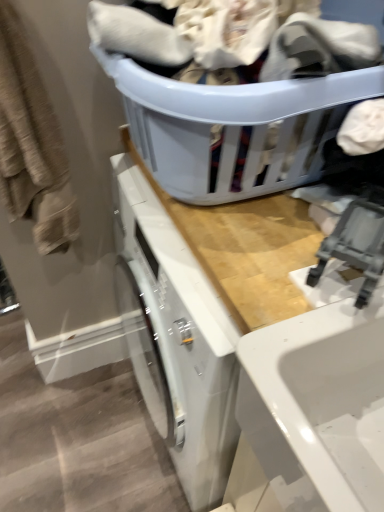
What do you see at coordinates (32, 145) in the screenshot?
I see `beige textured towel at left` at bounding box center [32, 145].

In order to face wooden counter at upper center, should I rotate leftwards or rightwards?

Turn right approximately 9.294 degrees to face it.

Describe the element at coordinates (258, 369) in the screenshot. I see `wooden counter at upper center` at that location.

Image resolution: width=384 pixels, height=512 pixels. In order to click on beige textured towel at left in this screenshot , I will do `click(32, 145)`.

Is wooden counter at upper center at the back of matte plastic laundry basket at upper center?

No.

Is matte plastic laundry basket at upper center not near wooden counter at upper center?

matte plastic laundry basket at upper center is actually quite close to wooden counter at upper center.

Can you confirm if matte plastic laundry basket at upper center is smaller than wooden counter at upper center?

Indeed, matte plastic laundry basket at upper center has a smaller size compared to wooden counter at upper center.

Which object is positioned more to the right, matte plastic laundry basket at upper center or wooden counter at upper center?

wooden counter at upper center is more to the right.

Could you tell me if beige textured towel at left is turned towards matte plastic laundry basket at upper center?

No.

Between beige textured towel at left and matte plastic laundry basket at upper center, which one appears on the left side from the viewer's perspective?

beige textured towel at left.

In the scene shown: Is wooden counter at upper center shorter than beige textured towel at left?

Incorrect, the height of wooden counter at upper center does not fall short of that of beige textured towel at left.

In terms of size, does wooden counter at upper center appear bigger or smaller than beige textured towel at left?

In the image, wooden counter at upper center appears to be larger than beige textured towel at left.

Does wooden counter at upper center appear on the left side of beige textured towel at left?

No.

Where is `counter top to the right of beige textured towel at left`? counter top to the right of beige textured towel at left is located at coordinates (258, 369).

Considering the sizes of objects wooden counter at upper center and matte plastic laundry basket at upper center in the image provided, who is taller, wooden counter at upper center or matte plastic laundry basket at upper center?

With more height is wooden counter at upper center.

From a real-world perspective, who is located lower, wooden counter at upper center or matte plastic laundry basket at upper center?

wooden counter at upper center is physically lower.

Is wooden counter at upper center directly adjacent to matte plastic laundry basket at upper center?

wooden counter at upper center is not next to matte plastic laundry basket at upper center, and they're not touching.

Between wooden counter at upper center and matte plastic laundry basket at upper center, which one has larger width?

wooden counter at upper center.

Which is more to the left, matte plastic laundry basket at upper center or beige textured towel at left?

beige textured towel at left.

From a real-world perspective, is matte plastic laundry basket at upper center physically located above or below beige textured towel at left?

matte plastic laundry basket at upper center is situated higher than beige textured towel at left in the real world.

In terms of height, does matte plastic laundry basket at upper center look taller or shorter compared to beige textured towel at left?

Clearly, matte plastic laundry basket at upper center is shorter compared to beige textured towel at left.

Considering the relative sizes of matte plastic laundry basket at upper center and beige textured towel at left in the image provided, is matte plastic laundry basket at upper center wider than beige textured towel at left?

Correct, the width of matte plastic laundry basket at upper center exceeds that of beige textured towel at left.

Considering their positions, is beige textured towel at left located in front of or behind wooden counter at upper center?

beige textured towel at left is positioned farther from the viewer than wooden counter at upper center.

Based on the photo, in terms of width, does beige textured towel at left look wider or thinner when compared to wooden counter at upper center?

beige textured towel at left is thinner than wooden counter at upper center.

Is beige textured towel at left looking in the opposite direction of wooden counter at upper center?

No, wooden counter at upper center is not at the back of beige textured towel at left.

Where is `basket that is on the left side of wooden counter at upper center`? The height and width of the screenshot is (512, 384). basket that is on the left side of wooden counter at upper center is located at coordinates (234, 127).

You are a GUI agent. You are given a task and a screenshot of the screen. Output one action in this format:
    pyautogui.click(x=<x>, y=<y>)
    Task: Click on the basket on the right side of beige textured towel at left
    The width and height of the screenshot is (384, 512).
    Given the screenshot: What is the action you would take?
    pyautogui.click(x=234, y=127)

Looking at the image, which one is located closer to matte plastic laundry basket at upper center, beige textured towel at left or wooden counter at upper center?

Among the two, wooden counter at upper center is located nearer to matte plastic laundry basket at upper center.

Looking at the image, which one is located closer to wooden counter at upper center, beige textured towel at left or matte plastic laundry basket at upper center?

matte plastic laundry basket at upper center.

Based on their spatial positions, is matte plastic laundry basket at upper center or beige textured towel at left closer to wooden counter at upper center?

matte plastic laundry basket at upper center is closer to wooden counter at upper center.

Estimate the real-world distances between objects in this image. Which object is closer to matte plastic laundry basket at upper center, wooden counter at upper center or beige textured towel at left?

wooden counter at upper center lies closer to matte plastic laundry basket at upper center than the other object.

Based on their spatial positions, is matte plastic laundry basket at upper center or wooden counter at upper center further from beige textured towel at left?

wooden counter at upper center is positioned further to the anchor beige textured towel at left.

From the image, which object appears to be nearer to beige textured towel at left, wooden counter at upper center or matte plastic laundry basket at upper center?

matte plastic laundry basket at upper center lies closer to beige textured towel at left than the other object.

The height and width of the screenshot is (512, 384). Identify the location of basket between beige textured towel at left and wooden counter at upper center. point(234,127).